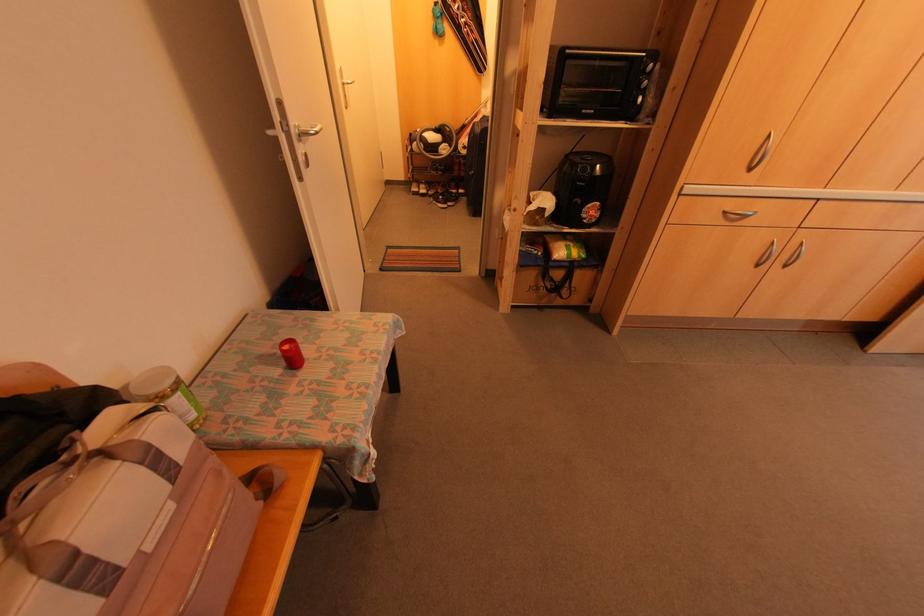
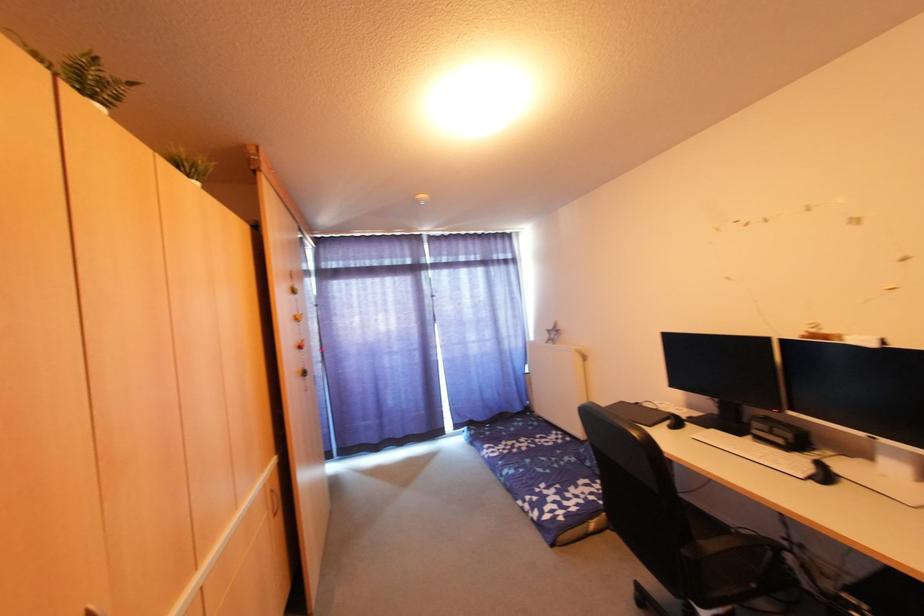
Question: Based on the continuous images, in which direction is the camera rotating? Reply with the corresponding letter.

Choices:
 (A) Left
 (B) Right
 (C) Up
 (D) Down

Answer: (B)